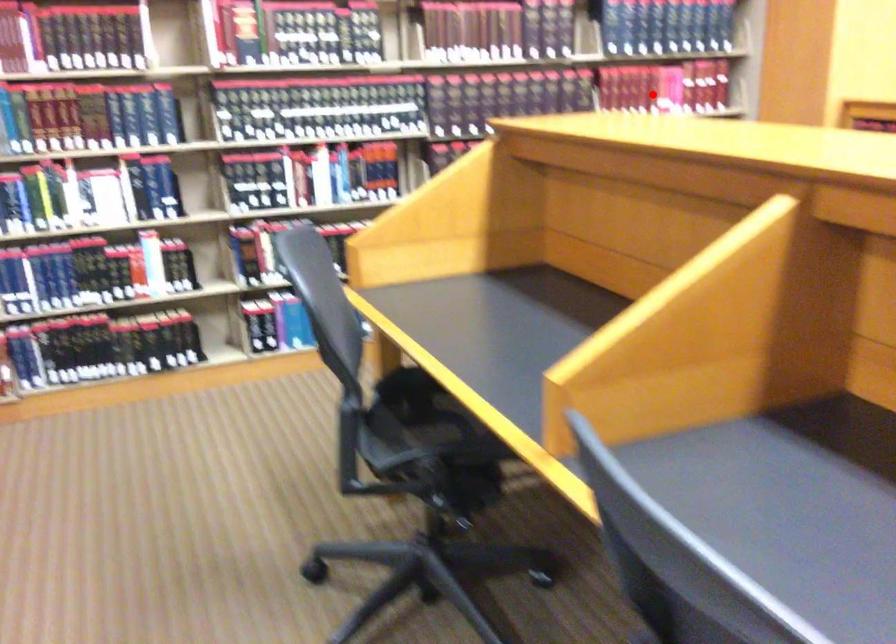
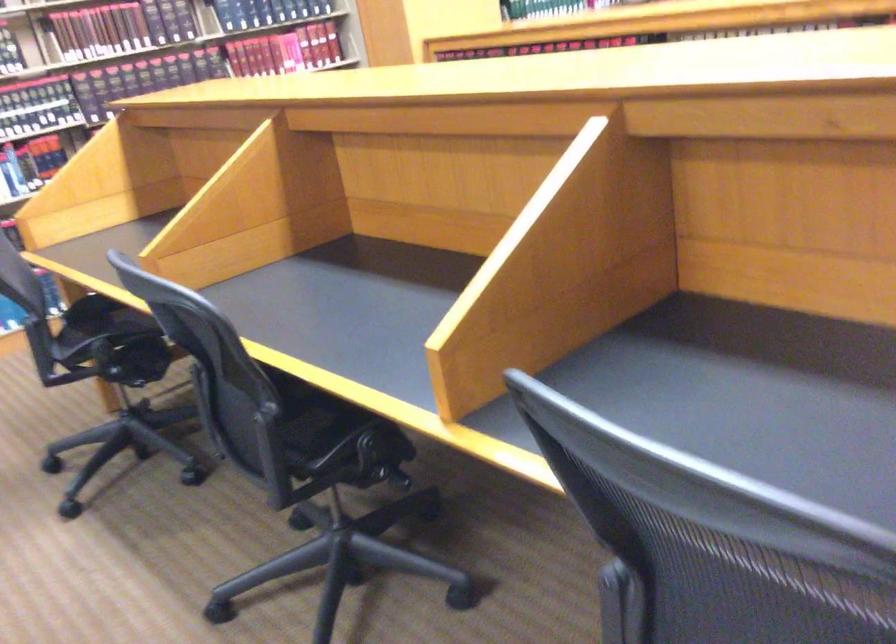
Question: I am providing you with two images of the same scene from different viewpoints. Image1 has a red point marked. In image2, the corresponding 3D location appears at what relative position? Reply with the corresponding letter.

Choices:
 (A) Closer
 (B) Farther

Answer: (B)